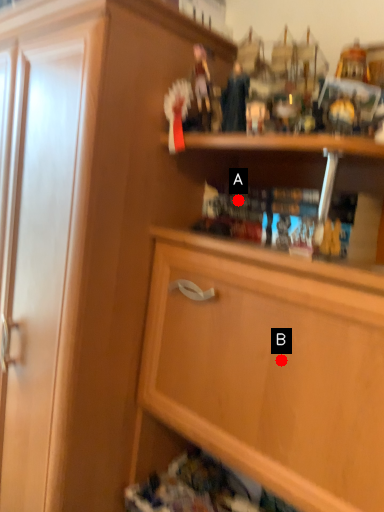
Question: Two points are circled on the image, labeled by A and B beside each circle. Which point is closer to the camera?

Choices:
 (A) A is closer
 (B) B is closer

Answer: (B)